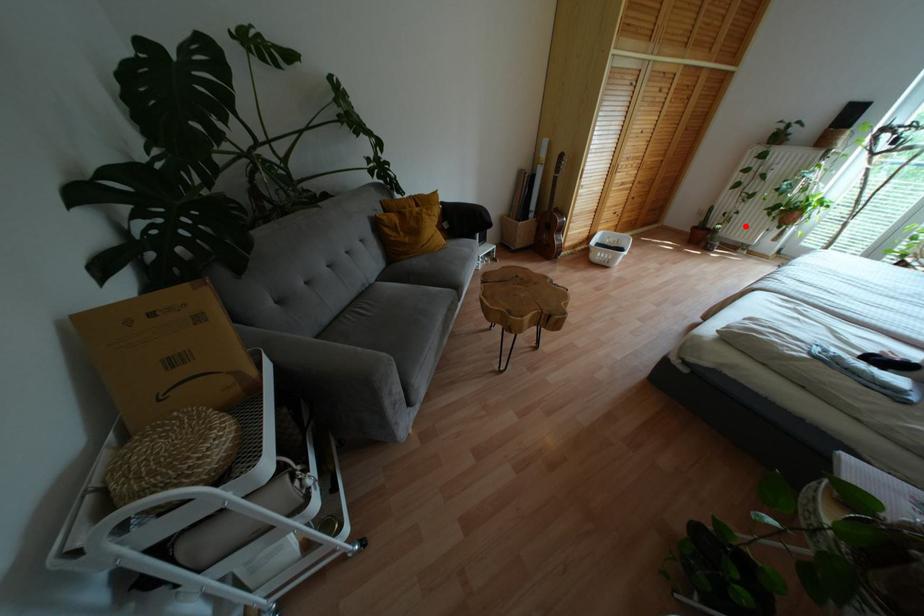
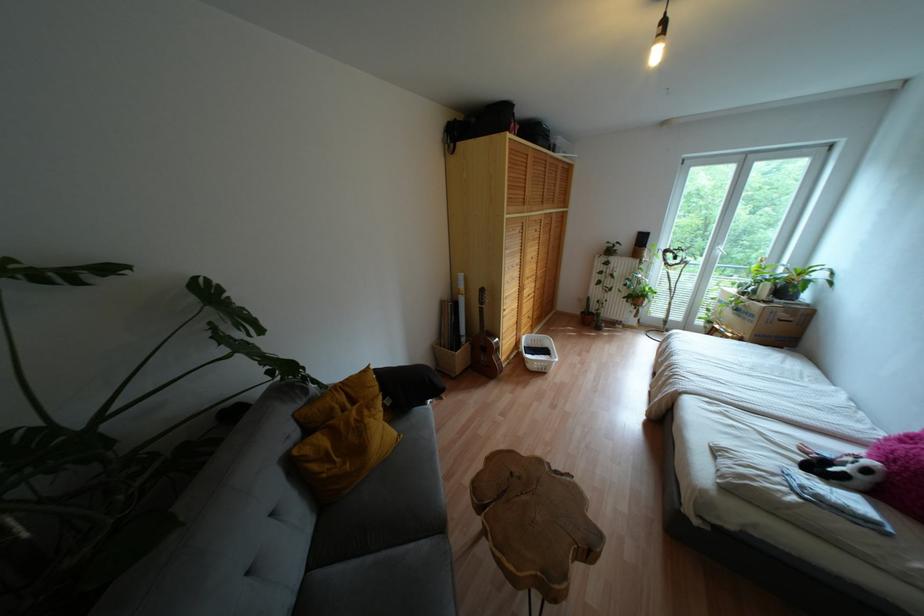
The point at the highlighted location is marked in the first image. Where is the corresponding point in the second image?

(614, 309)